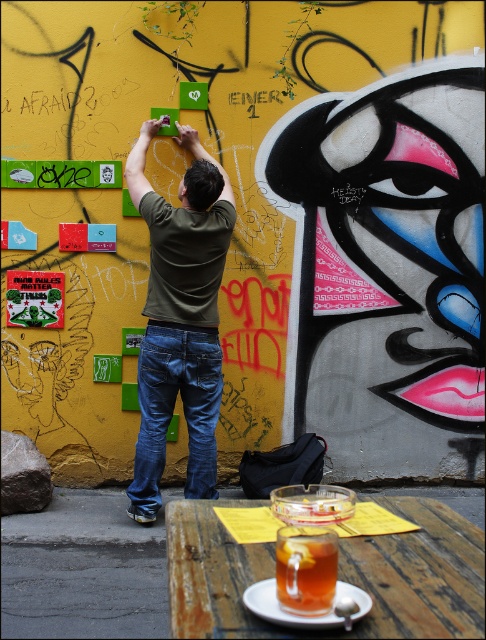
Who is higher up, green matte shirt at center or translucent glass cup at lower center?

green matte shirt at center is higher up.

Identify the location of green matte shirt at center. (179, 317).

Describe the element at coordinates (173, 410) in the screenshot. I see `denim at center` at that location.

Is denim at center wider than translucent glass cup at lower center?

Correct, the width of denim at center exceeds that of translucent glass cup at lower center.

Describe the element at coordinates (173, 410) in the screenshot. I see `denim at center` at that location.

This screenshot has height=640, width=486. I want to click on denim at center, so click(x=173, y=410).

Between green matte shirt at center and denim at center, which one has more height?

green matte shirt at center is taller.

How distant is green matte shirt at center from denim at center?

green matte shirt at center and denim at center are 6.62 inches apart from each other.

Between point (221, 241) and point (141, 444), which one is positioned in front?

Point (221, 241) is in front.

Find the location of `green matte shirt at center`. green matte shirt at center is located at coordinates (179, 317).